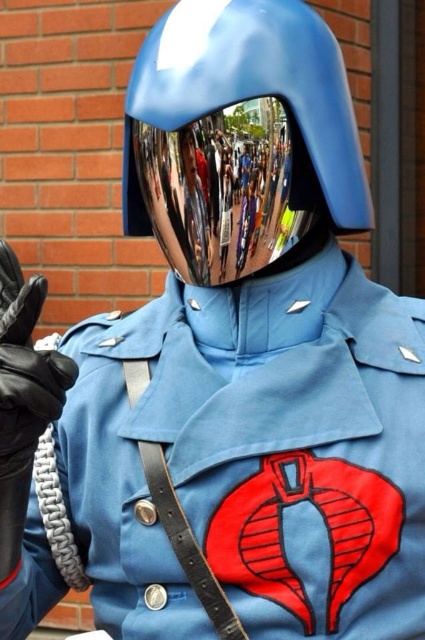
Identify the location of shiny metallic helmet at center. (240, 138).

Who is more forward, (221, 122) or (2, 308)?

Point (2, 308)

What do you see at coordinates (240, 138) in the screenshot? I see `shiny metallic helmet at center` at bounding box center [240, 138].

Identify the location of shiny metallic helmet at center. click(240, 138).